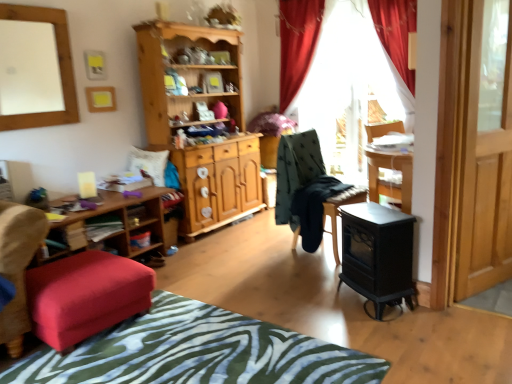
Where is `vacant space in front of dark green fabric chair at center`? This screenshot has width=512, height=384. vacant space in front of dark green fabric chair at center is located at coordinates (308, 273).